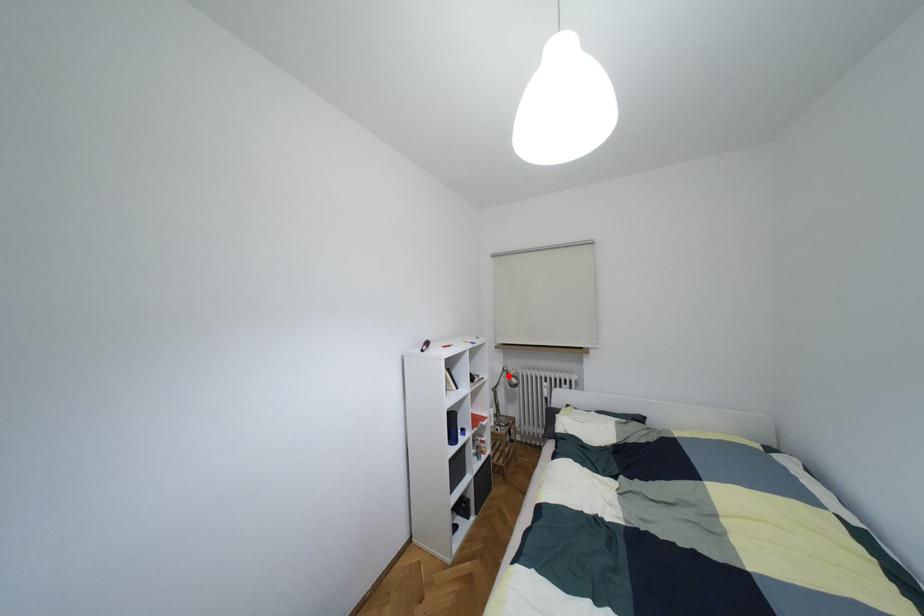
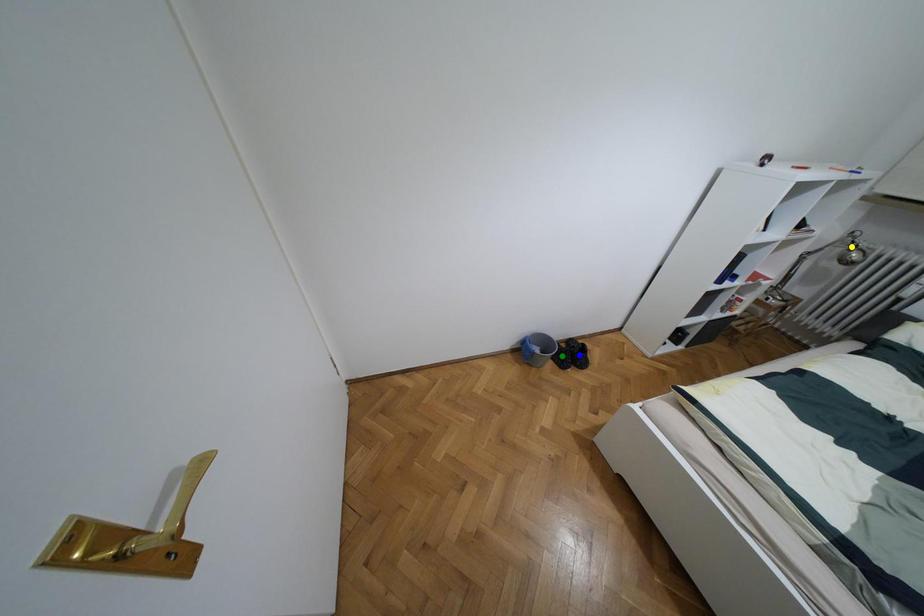
Question: I am providing you with two images of the same scene from different viewpoints. A red point is marked on the first image. You are given multiple points on the second image. Which point in image 2 is actually the same real-world point as the red point in image 1?

Choices:
 (A) yellow point
 (B) blue point
 (C) green point

Answer: (A)